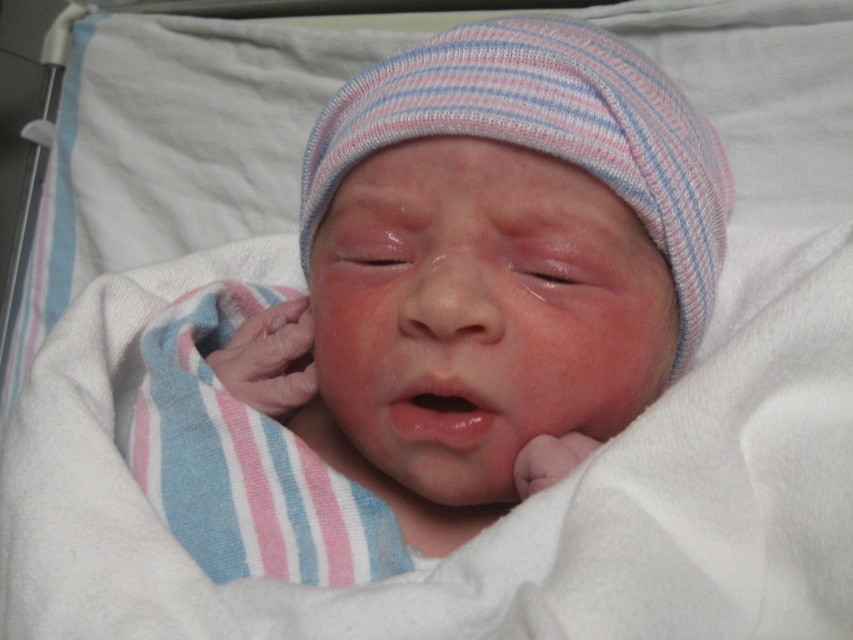
Is striped knit hat at center to the right of pink matte/skin-like mouth at center from the viewer's perspective?

Yes, striped knit hat at center is to the right of pink matte/skin-like mouth at center.

Is point (445, 67) farther from camera compared to point (393, 429)?

Yes, it is behind point (393, 429).

Image resolution: width=853 pixels, height=640 pixels. What are the coordinates of `striped knit hat at center` in the screenshot? It's located at (544, 132).